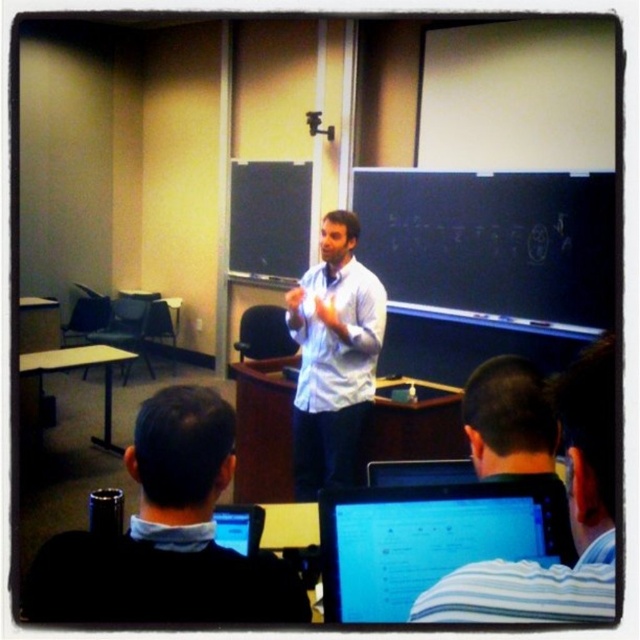
You are a student sitting in the classroom and want to point out something on the blackboard. You notice two points on the blackboard marked as point 1 at coordinates (365, 580) and point 2 at (356, 419). Which point is closer to you?

Point (365, 580) is closer to the viewer than point (356, 419).

You are a student sitting at the front row of the classroom. You want to look at the matte black monitor at lower center. Where should you look relative to the students in front of you?

The matte black monitor at lower center is located at point [429,538], so you should look towards that coordinate to see it. Since the students in front are seated facing forward, you might need to look slightly behind them or adjust your angle to avoid obstruction.

You are a student sitting at the back of the classroom. You want to borrow a sweater from the black sweater at lower left. Can you reach it without moving from your seat?

The black sweater at lower left is located at point (166,534) in the image, which is near the lower left corner. Since you are sitting at the back, it might be difficult to reach without moving closer. However, the exact spatial relationship isn